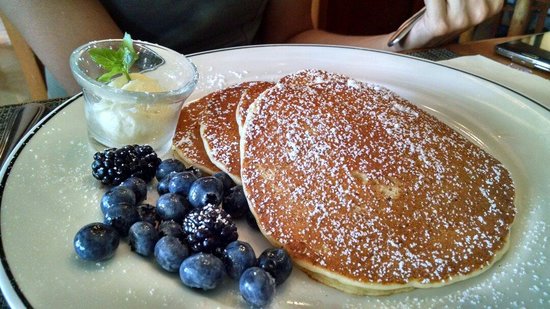
Locate an element on the screen. Image resolution: width=550 pixels, height=309 pixels. wooden table leg in the background on the top right is located at coordinates (526, 20).